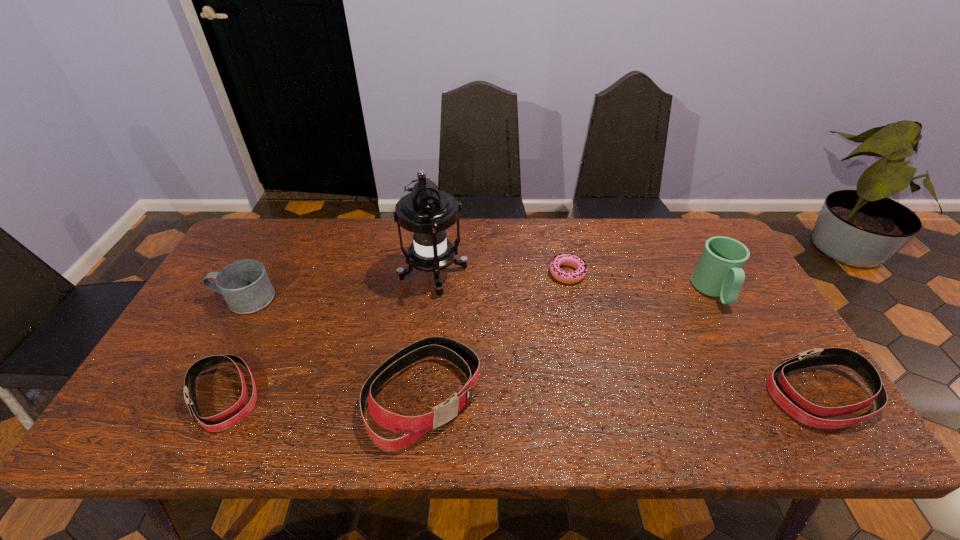
Identify the location of the leftmost dog collar. The image size is (960, 540). (191, 375).

Find the location of a particular element. The width and height of the screenshot is (960, 540). the second shortest object is located at coordinates (191, 375).

Image resolution: width=960 pixels, height=540 pixels. Identify the location of the second dog collar from right to left. (414, 427).

I want to click on the second shortest dog collar, so click(787, 398).

The width and height of the screenshot is (960, 540). What are the coordinates of `the fifth tallest object` in the screenshot? It's located at pyautogui.click(x=787, y=398).

Image resolution: width=960 pixels, height=540 pixels. Find the location of `the right mug`. the right mug is located at coordinates (x=719, y=273).

The width and height of the screenshot is (960, 540). I want to click on the taller mug, so click(x=719, y=273).

Identify the location of the tallest object. The image size is (960, 540). (426, 212).

The image size is (960, 540). What are the coordinates of `the shortest object` in the screenshot? It's located at (578, 263).

Where is `doughnut`? doughnut is located at coordinates 578,263.